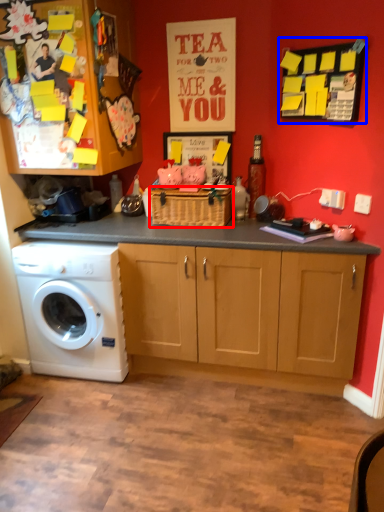
Question: Among these objects, which one is farthest to the camera, basket (highlighted by a red box) or bulletin board (highlighted by a blue box)?

Choices:
 (A) basket
 (B) bulletin board

Answer: (A)